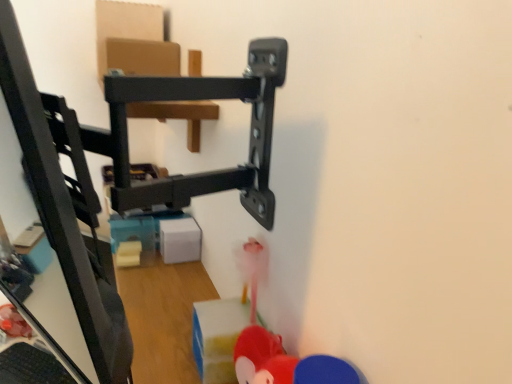
I want to click on free space above black plastic keyboard at lower left (from a real-world perspective), so click(33, 366).